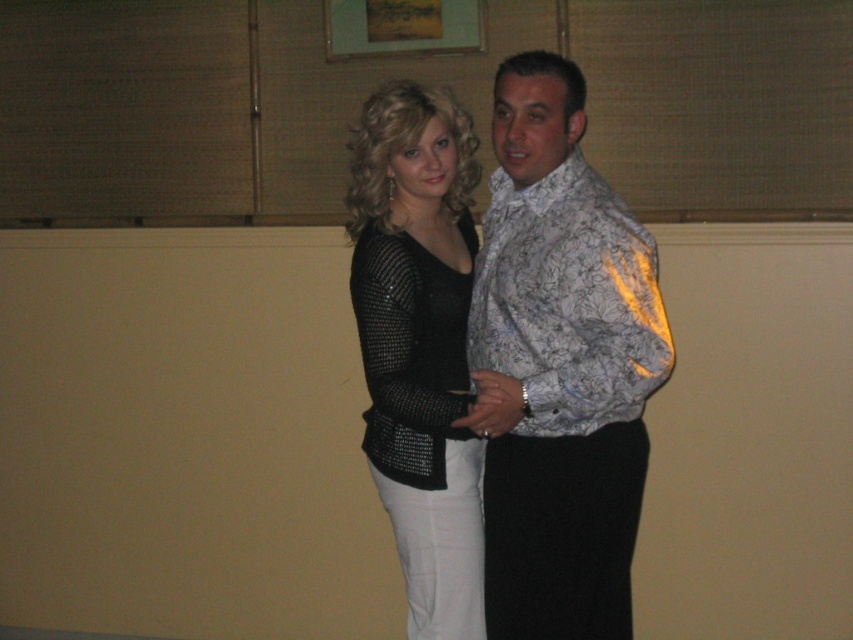
In the scene shown: You are a photographer setting up for a photoshoot. You need to decide which outfit to feature in the main frame. Based on the scene, which object is taller between the shiny silver shirt at center and the black sequined dress at center?

The shiny silver shirt at center is taller than the black sequined dress at center, so it should be chosen for the main frame to emphasize its height advantage.